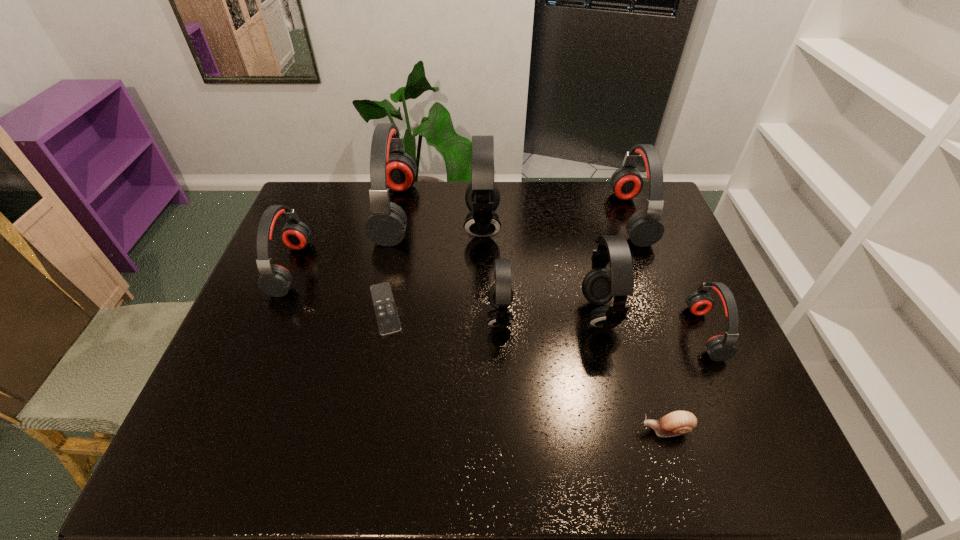
Find the location of `blank space at the left edge of the desktop`. blank space at the left edge of the desktop is located at coordinates (330, 227).

This screenshot has height=540, width=960. Identify the location of vacant space at the right edge of the desktop. (666, 336).

Where is `vacant area at the far left corner`? vacant area at the far left corner is located at coordinates (333, 187).

Where is `blank region between the shortest object and the third earphone from right to left`? This screenshot has height=540, width=960. blank region between the shortest object and the third earphone from right to left is located at coordinates (492, 311).

At what (x,y) coordinates should I click in order to perform the action: click on vacant space that is in between the rightmost black earphone and the nearest object. Please return your answer as a coordinate pair (x, y). The image size is (960, 540). Looking at the image, I should click on (633, 372).

Where is `blank region between the second biggest red earphone and the leftmost earphone`? This screenshot has width=960, height=540. blank region between the second biggest red earphone and the leftmost earphone is located at coordinates (461, 242).

I want to click on vacant area between the escargot and the second biggest black earphone, so click(633, 372).

Identify the location of vacant area that lies between the seventh tallest object and the third smallest red earphone. Image resolution: width=960 pixels, height=540 pixels. (668, 275).

Locate an element on the screen. This screenshot has width=960, height=540. empty location between the third smallest red earphone and the second shortest object is located at coordinates (649, 323).

Find the location of a particular element. The width and height of the screenshot is (960, 540). free space between the sixth earphone from right to left and the shortest object is located at coordinates (391, 260).